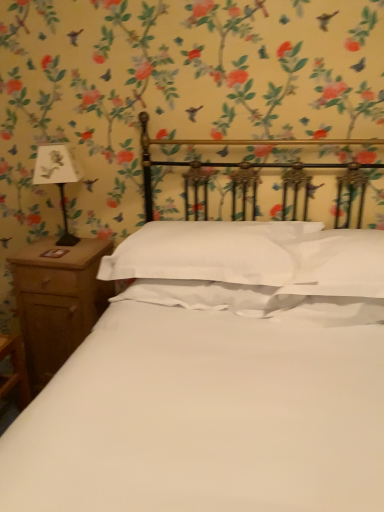
You are a GUI agent. You are given a task and a screenshot of the screen. Output one action in this format:
    pyautogui.click(x=<x>, y=<y>)
    Task: Click on the brown wood nightstand at left
    The height and width of the screenshot is (512, 384).
    Given the screenshot: What is the action you would take?
    pyautogui.click(x=57, y=301)

Consider the image. What is the approximate height of brown wood nightstand at left?

The height of brown wood nightstand at left is 75.64 centimeters.

At what (x,y) coordinates should I click in order to perform the action: click on white smooth pillow at center. Please return your answer as a coordinate pair (x, y). This screenshot has height=512, width=384. Looking at the image, I should click on (208, 252).

Which point is more distant from viewer, (13, 269) or (226, 234)?

Point (13, 269)

Which object is further away from the camera, brown wood nightstand at left or white smooth pillow at center?

brown wood nightstand at left is further from the camera.

Could you tell me if brown wood nightstand at left is turned towards white smooth pillow at center?

No, brown wood nightstand at left is not aimed at white smooth pillow at center.

Is white smooth pillow at center surrounded by brown wood nightstand at left?

That's incorrect, white smooth pillow at center is not inside brown wood nightstand at left.

Does point (236, 257) appear closer or farther from the camera than point (106, 242)?

Point (236, 257) is positioned closer to the camera compared to point (106, 242).

Is the surface of white smooth pillow at center in direct contact with brown wood nightstand at left?

No, white smooth pillow at center is not next to brown wood nightstand at left.

Can you confirm if white smooth pillow at center is positioned to the right of brown wood nightstand at left?

Yes.

In the scene shown: Can brown wood nightstand at left be found inside white smooth pillow at center?

No, brown wood nightstand at left is not a part of white smooth pillow at center.

Who is smaller, white smooth pillow at center or white paper at left?

white paper at left is smaller.

Which point is more forward, (105, 262) or (58, 159)?

The point (105, 262) is in front.

Is white smooth pillow at center inside the boundaries of white paper at left, or outside?

white smooth pillow at center exists outside the volume of white paper at left.

Considering the sizes of objects white smooth pillow at center and white paper at left in the image provided, who is wider, white smooth pillow at center or white paper at left?

white smooth pillow at center is wider.

Identify the location of pillow lying below the white paper at left (from the image's perspective). This screenshot has width=384, height=512. (208, 252).

In the scene shown: Is white paper at left closer to the viewer compared to white smooth pillow at center?

No, white paper at left is further to the viewer.

Looking at the image, does white paper at left seem bigger or smaller compared to white smooth pillow at center?

Considering their sizes, white paper at left takes up less space than white smooth pillow at center.

Can we say brown wood nightstand at left lies outside white paper at left?

Yes.

Are brown wood nightstand at left and white paper at left far apart?

No, brown wood nightstand at left is in close proximity to white paper at left.

Which is in front, point (39, 178) or point (57, 300)?

The point (39, 178) is in front.

From a real-world perspective, which is physically above, white paper at left or brown wood nightstand at left?

white paper at left.

Can you confirm if white paper at left is smaller than brown wood nightstand at left?

Correct, white paper at left occupies less space than brown wood nightstand at left.

Is white paper at left closer to camera compared to brown wood nightstand at left?

Yes, it is in front of brown wood nightstand at left.

In order to click on nightstand below the white smooth pillow at center (from the image's perspective) in this screenshot , I will do `click(57, 301)`.

Where is `nightstand that appears on the left of white smooth pillow at center`? This screenshot has height=512, width=384. nightstand that appears on the left of white smooth pillow at center is located at coordinates (57, 301).

From the image, which object appears to be nearer to white paper at left, white smooth pillow at center or brown wood nightstand at left?

brown wood nightstand at left lies closer to white paper at left than the other object.

Considering their positions, is brown wood nightstand at left positioned further to white paper at left than white smooth pillow at center?

white smooth pillow at center.

From the image, which object appears to be farther from brown wood nightstand at left, white smooth pillow at center or white paper at left?

Based on the image, white smooth pillow at center appears to be further to brown wood nightstand at left.

Which object lies nearer to the anchor point brown wood nightstand at left, white paper at left or white smooth pillow at center?

white paper at left is closer to brown wood nightstand at left.

In the scene shown: Based on their spatial positions, is white paper at left or brown wood nightstand at left further from white smooth pillow at center?

Among the two, white paper at left is located further to white smooth pillow at center.

From the image, which object appears to be nearer to white smooth pillow at center, brown wood nightstand at left or white paper at left?

brown wood nightstand at left is closer to white smooth pillow at center.

You are a GUI agent. You are given a task and a screenshot of the screen. Output one action in this format:
    pyautogui.click(x=<x>, y=<y>)
    Task: Click on the nightstand located between white paper at left and white smooth pillow at center in the left-right direction
    This screenshot has height=512, width=384.
    Given the screenshot: What is the action you would take?
    pyautogui.click(x=57, y=301)